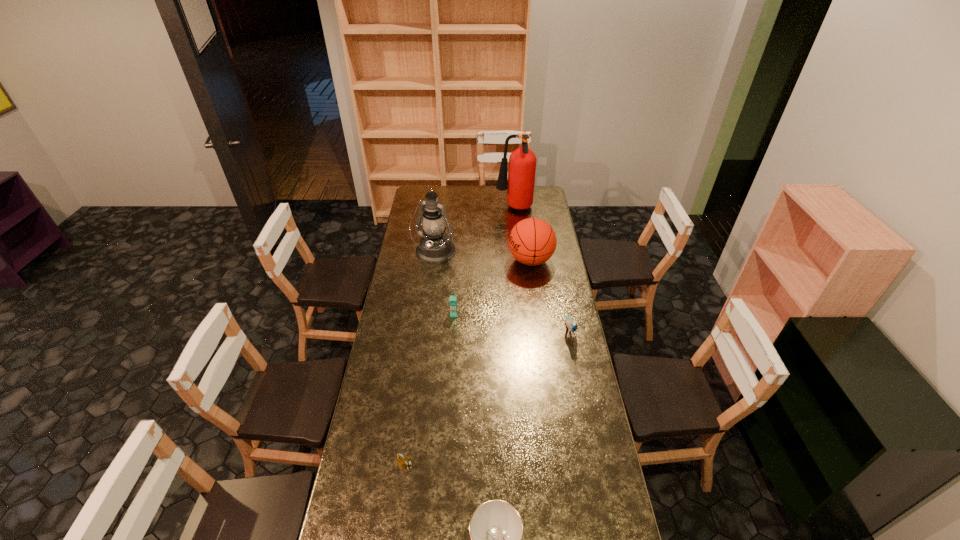
Where is `vacant position located on the right of the oil lamp`? This screenshot has height=540, width=960. vacant position located on the right of the oil lamp is located at coordinates (475, 253).

This screenshot has height=540, width=960. In order to click on vacant space located 0.150m on the side with logo of the third tallest object in this screenshot , I will do `click(480, 260)`.

This screenshot has height=540, width=960. I want to click on vacant region located on the side with logo of the third tallest object, so (x=456, y=260).

The height and width of the screenshot is (540, 960). I want to click on free space located on the side with logo of the third tallest object, so click(x=476, y=260).

This screenshot has height=540, width=960. Identify the location of blank area located on the keypad of the cellular telephone. (453, 330).

The height and width of the screenshot is (540, 960). I want to click on vacant space located at the face of the bird, so click(588, 420).

Find the location of a particular element. This screenshot has height=540, width=960. blank space located 0.080m on the side with the combination dials of the padlock is located at coordinates (401, 494).

I want to click on object that is positioned at the far edge, so click(x=522, y=162).

Image resolution: width=960 pixels, height=540 pixels. Identify the location of oil lamp present at the left edge. (435, 247).

Identify the location of padlock that is at the left edge. (401, 460).